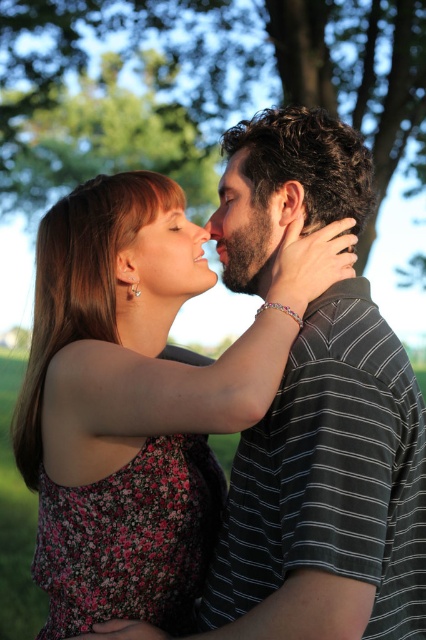
You are standing in the park and want to take a photo of the bearded man at center and the green leafy tree at upper center. Which object is higher in the image?

The green leafy tree at upper center is higher in the image than the bearded man at center because it is located above him.

You are a photographer adjusting your camera settings to focus on two specific points in the scene. The first point is at coordinates point (x=52, y=96) and the second is at point (x=253, y=211). Which point should you focus on first if you want to ensure the closest object is in sharp focus?

Point (x=52, y=96) is closer to the camera than point (x=253, y=211), so you should focus on point (x=52, y=96) first to ensure the closest object is in sharp focus.